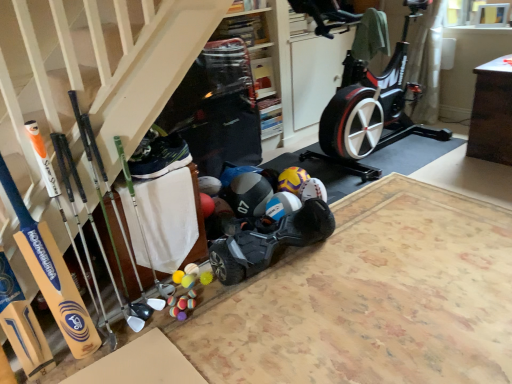
Describe the element at coordinates (248, 194) in the screenshot. This screenshot has width=512, height=384. I see `blue matte helmet at center` at that location.

Where is `black fabric shoe at center`? black fabric shoe at center is located at coordinates (161, 157).

What do you see at coordinates (92, 74) in the screenshot? The width and height of the screenshot is (512, 384). I see `wooden stairs at lower left` at bounding box center [92, 74].

You are a GUI agent. You are given a task and a screenshot of the screen. Output one action in this format:
    pyautogui.click(x=<x>, y=<y>)
    Task: Click on the wooden stairs at lower left
    
    Given the screenshot: What is the action you would take?
    point(92,74)

Find the location of `blue matte helmet at center`. blue matte helmet at center is located at coordinates (248, 194).

Is there a large distance between wooden stairs at lower left and black matte hoverboard at center?

No, there isn't a large distance between wooden stairs at lower left and black matte hoverboard at center.

From the image's perspective, would you say wooden stairs at lower left is shown under black matte hoverboard at center?

No.

Is wooden stairs at lower left positioned behind black matte hoverboard at center?

No, the depth of wooden stairs at lower left is less than that of black matte hoverboard at center.

This screenshot has width=512, height=384. Identify the location of stairs located above the black matte hoverboard at center (from a real-world perspective). pyautogui.click(x=92, y=74).

The height and width of the screenshot is (384, 512). In order to click on shoe positioned vertically above the blue matte helmet at center (from a real-world perspective) in this screenshot , I will do `click(161, 157)`.

How distant is blue matte helmet at center from black fabric shoe at center?

blue matte helmet at center and black fabric shoe at center are 21.74 inches apart from each other.

Does blue matte helmet at center appear on the left side of black fabric shoe at center?

Incorrect, blue matte helmet at center is not on the left side of black fabric shoe at center.

Is black fabric shoe at center far from blue matte helmet at center?

black fabric shoe at center is actually quite close to blue matte helmet at center.

From the image's perspective, is black fabric shoe at center located above or below blue matte helmet at center?

Clearly, from the image's perspective, black fabric shoe at center is above blue matte helmet at center.

Looking at this image, which of these two, black fabric shoe at center or blue matte helmet at center, stands taller?

Standing taller between the two is blue matte helmet at center.

Can you confirm if black fabric shoe at center is bigger than blue matte helmet at center?

Actually, black fabric shoe at center might be smaller than blue matte helmet at center.

From the image's perspective, which is above, black matte hoverboard at center or wooden stairs at lower left?

wooden stairs at lower left.

Is black matte hoverboard at center not inside wooden stairs at lower left?

Yes, black matte hoverboard at center is located beyond the bounds of wooden stairs at lower left.

Considering the sizes of objects black matte hoverboard at center and wooden stairs at lower left in the image provided, who is taller, black matte hoverboard at center or wooden stairs at lower left?

wooden stairs at lower left.

Can you confirm if blue matte helmet at center is taller than wooden stairs at lower left?

No.

From the image's perspective, who appears lower, blue matte helmet at center or wooden stairs at lower left?

blue matte helmet at center is shown below in the image.

From a real-world perspective, who is located lower, blue matte helmet at center or wooden stairs at lower left?

In real-world perspective, blue matte helmet at center is lower.

Is black matte hoverboard at center taller or shorter than black fabric shoe at center?

Considering their sizes, black matte hoverboard at center has more height than black fabric shoe at center.

Could you tell me if black matte hoverboard at center is facing black fabric shoe at center?

No, black matte hoverboard at center is not facing towards black fabric shoe at center.

Is black matte hoverboard at center to the left of black fabric shoe at center from the viewer's perspective?

No.

Who is bigger, black matte hoverboard at center or black fabric shoe at center?

Bigger between the two is black matte hoverboard at center.

Is black matte hoverboard at center completely or partially outside of blue matte helmet at center?

black matte hoverboard at center is positioned outside blue matte helmet at center.

Is black matte hoverboard at center facing towards blue matte helmet at center?

No, black matte hoverboard at center is not aimed at blue matte helmet at center.

Which object is closer to the camera, black matte hoverboard at center or blue matte helmet at center?

Positioned in front is black matte hoverboard at center.

Looking at their sizes, would you say black matte hoverboard at center is wider or thinner than blue matte helmet at center?

Considering their sizes, black matte hoverboard at center looks slimmer than blue matte helmet at center.

The image size is (512, 384). Identify the location of stairs on the left of black matte hoverboard at center. (92, 74).

The height and width of the screenshot is (384, 512). Find the location of `sports equipment that appears below the black fabric shoe at center (from the image's perspective)`. sports equipment that appears below the black fabric shoe at center (from the image's perspective) is located at coordinates (248, 194).

Based on their spatial positions, is wooden stairs at lower left or black matte hoverboard at center closer to black fabric shoe at center?

wooden stairs at lower left lies closer to black fabric shoe at center than the other object.

Considering their positions, is black matte hoverboard at center positioned further to blue matte helmet at center than black fabric shoe at center?

black fabric shoe at center is positioned further to the anchor blue matte helmet at center.

Which object lies nearer to the anchor point black matte hoverboard at center, blue matte helmet at center or black fabric shoe at center?

blue matte helmet at center lies closer to black matte hoverboard at center than the other object.

Considering their positions, is wooden stairs at lower left positioned closer to blue matte helmet at center than black matte hoverboard at center?

Among the two, black matte hoverboard at center is located nearer to blue matte helmet at center.

From the image, which object appears to be nearer to blue matte helmet at center, black fabric shoe at center or wooden stairs at lower left?

The object closer to blue matte helmet at center is black fabric shoe at center.

Considering their positions, is wooden stairs at lower left positioned further to black matte hoverboard at center than blue matte helmet at center?

wooden stairs at lower left is positioned further to the anchor black matte hoverboard at center.

Which object lies further to the anchor point black fabric shoe at center, black matte hoverboard at center or wooden stairs at lower left?

Based on the image, black matte hoverboard at center appears to be further to black fabric shoe at center.

Estimate the real-world distances between objects in this image. Which object is closer to black matte hoverboard at center, black fabric shoe at center or blue matte helmet at center?

Based on the image, blue matte helmet at center appears to be nearer to black matte hoverboard at center.

Identify the location of car located between black fabric shoe at center and blue matte helmet at center in the depth direction. The width and height of the screenshot is (512, 384). (269, 242).

Locate an element on the screen. The image size is (512, 384). shoe between wooden stairs at lower left and black matte hoverboard at center in the front-back direction is located at coordinates (161, 157).

At what (x,y) coordinates should I click in order to perform the action: click on shoe located between wooden stairs at lower left and blue matte helmet at center in the depth direction. Please return your answer as a coordinate pair (x, y). This screenshot has width=512, height=384. Looking at the image, I should click on (161, 157).

Where is `car positioned between wooden stairs at lower left and blue matte helmet at center from near to far`? car positioned between wooden stairs at lower left and blue matte helmet at center from near to far is located at coordinates (269, 242).